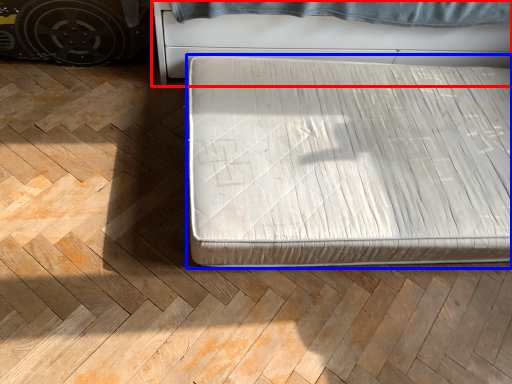
Question: Which point is further to the camera, furniture (highlighted by a red box) or bed (highlighted by a blue box)?

Choices:
 (A) furniture
 (B) bed

Answer: (A)